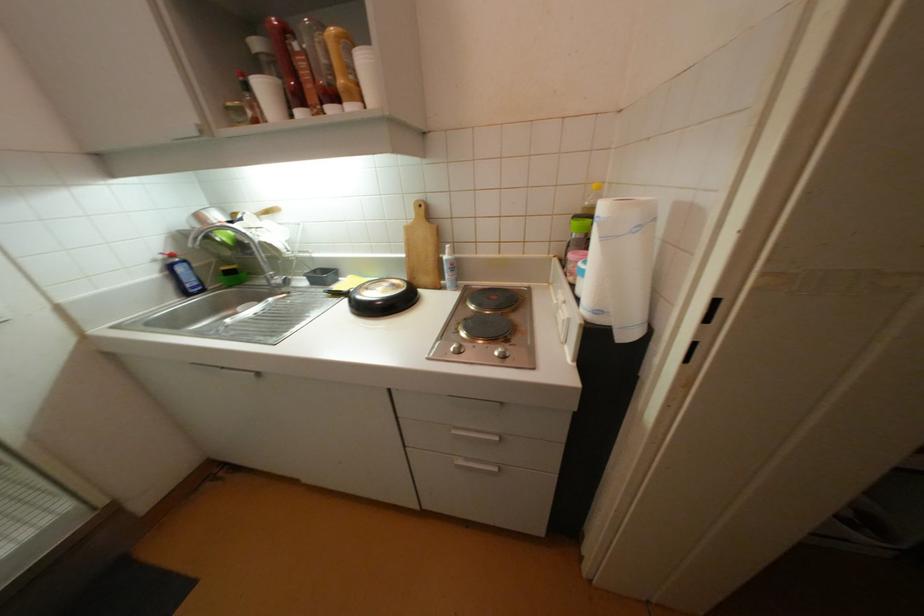
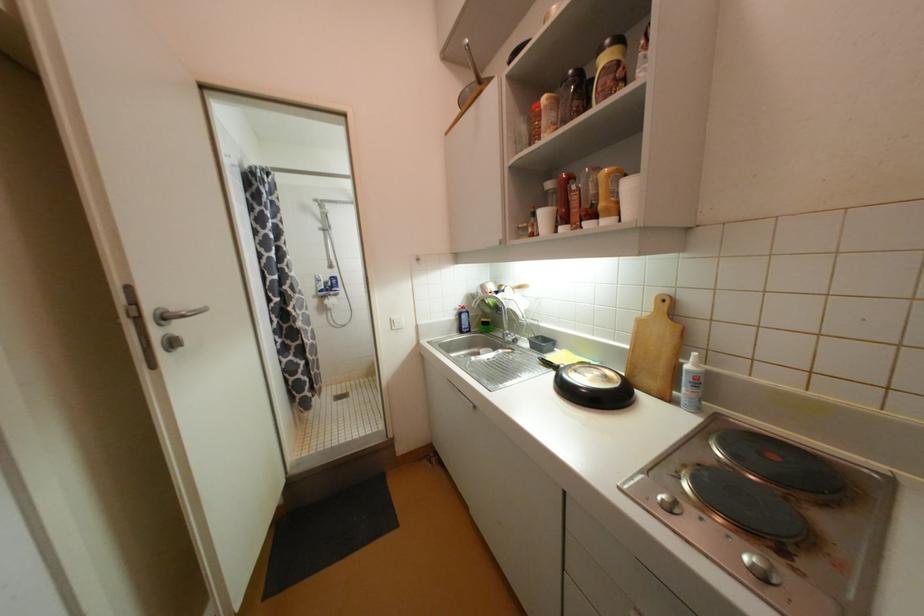
Find the pixel in the second image that matches point 451,257 in the first image.

(693, 368)